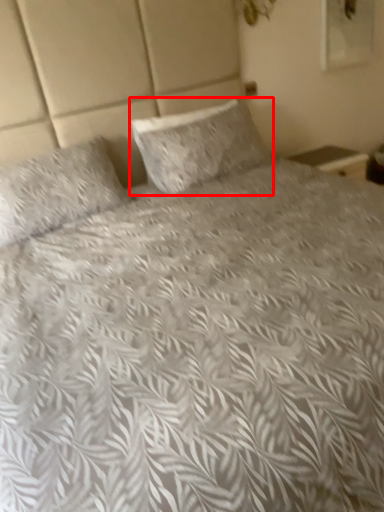
Question: From the image's perspective, what is the correct spatial relationship of pillow (annotated by the red box) in relation to pillow?

Choices:
 (A) above
 (B) below

Answer: (A)